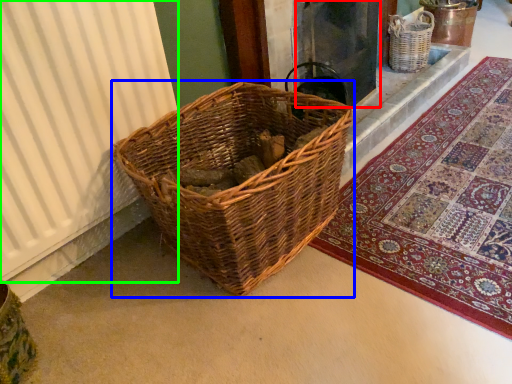
Question: Which object is the farthest from screen door (highlighted by a red box)? Choose among these: picnic basket (highlighted by a blue box) or curtain (highlighted by a green box).

Choices:
 (A) picnic basket
 (B) curtain

Answer: (B)